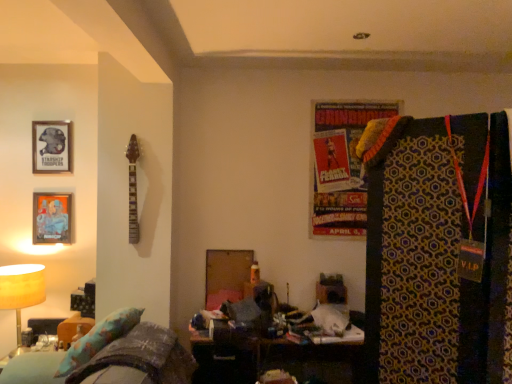
Question: Is metallic silver picture frame at left, the 1th picture frame ordered from the bottom, to the left of matte yellow lampshade at left from the viewer's perspective?

Choices:
 (A) yes
 (B) no

Answer: (B)

Question: Is metallic silver picture frame at left, the 1th picture frame ordered from the bottom, bigger than matte yellow lampshade at left?

Choices:
 (A) no
 (B) yes

Answer: (A)

Question: From a real-world perspective, is metallic silver picture frame at left, the 1th picture frame ordered from the bottom, physically above matte yellow lampshade at left?

Choices:
 (A) no
 (B) yes

Answer: (B)

Question: Is metallic silver picture frame at left, the 1th picture frame ordered from the bottom, not near matte yellow lampshade at left?

Choices:
 (A) no
 (B) yes

Answer: (A)

Question: Could you tell me if metallic silver picture frame at left, the 1th picture frame ordered from the bottom, is turned towards matte yellow lampshade at left?

Choices:
 (A) yes
 (B) no

Answer: (B)

Question: Is metallic silver picture frame at left, the 1th picture frame ordered from the bottom, with matte yellow lampshade at left?

Choices:
 (A) yes
 (B) no

Answer: (B)

Question: Can you confirm if metallic silver picture frame at left, the 1th picture frame ordered from the bottom, is thinner than metallic silver picture frame at upper left, which appears as the 2th picture frame when ordered from the bottom?

Choices:
 (A) no
 (B) yes

Answer: (B)

Question: From the image's perspective, would you say metallic silver picture frame at left, the 1th picture frame ordered from the bottom, is positioned over metallic silver picture frame at upper left, positioned as the 1th picture frame in top-to-bottom order?

Choices:
 (A) yes
 (B) no

Answer: (B)

Question: Would you say metallic silver picture frame at upper left, positioned as the 1th picture frame in top-to-bottom order, is part of metallic silver picture frame at left, which is the second picture frame from top to bottom,'s contents?

Choices:
 (A) no
 (B) yes

Answer: (A)

Question: Does metallic silver picture frame at left, which is the second picture frame from top to bottom, have a larger size compared to metallic silver picture frame at upper left, which appears as the 2th picture frame when ordered from the bottom?

Choices:
 (A) no
 (B) yes

Answer: (B)

Question: Could you tell me if metallic silver picture frame at left, the 1th picture frame ordered from the bottom, is facing metallic silver picture frame at upper left, which appears as the 2th picture frame when ordered from the bottom?

Choices:
 (A) yes
 (B) no

Answer: (B)

Question: From the image's perspective, is metallic silver picture frame at left, which is the second picture frame from top to bottom, under metallic silver picture frame at upper left, which appears as the 2th picture frame when ordered from the bottom?

Choices:
 (A) no
 (B) yes

Answer: (B)

Question: From a real-world perspective, is matte yellow lampshade at left located higher than metallic silver picture frame at upper left, positioned as the 1th picture frame in top-to-bottom order?

Choices:
 (A) yes
 (B) no

Answer: (B)